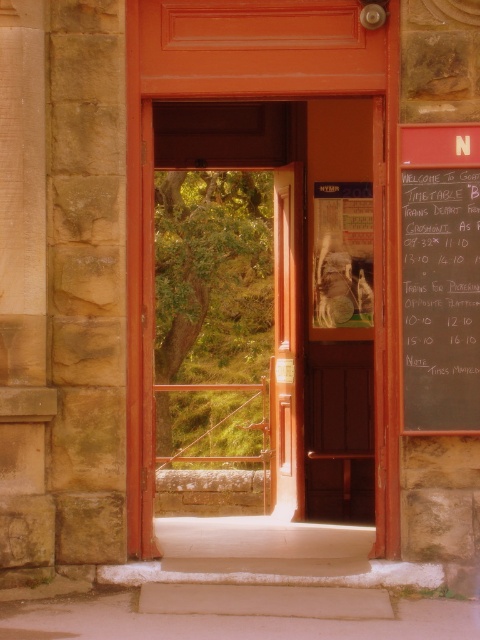
Question: Among these points, which one is nearest to the camera?

Choices:
 (A) (471, 268)
 (B) (239, 150)

Answer: (A)

Question: Does wooden door at center have a greater width compared to black chalkboard at right?

Choices:
 (A) yes
 (B) no

Answer: (A)

Question: Considering the relative positions of wooden door at center and black chalkboard at right in the image provided, where is wooden door at center located with respect to black chalkboard at right?

Choices:
 (A) right
 (B) left

Answer: (B)

Question: Which point is farther to the camera?

Choices:
 (A) (430, 193)
 (B) (160, 385)

Answer: (B)

Question: Does wooden door at center have a larger size compared to black chalkboard at right?

Choices:
 (A) yes
 (B) no

Answer: (A)